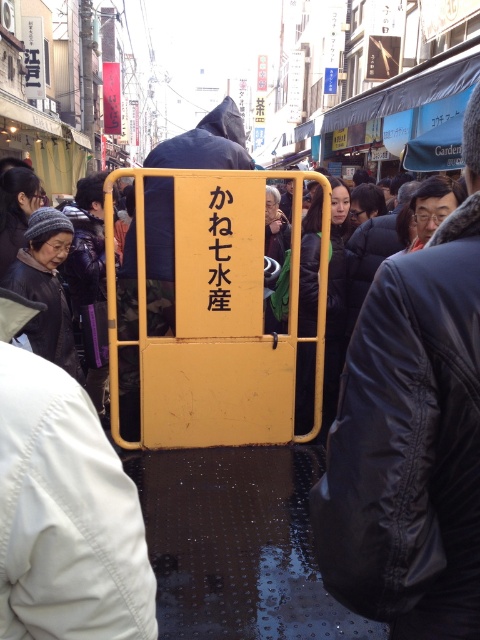
Question: Can you confirm if yellow matte gate at center is bigger than dark gray knit hat at left?

Choices:
 (A) yes
 (B) no

Answer: (B)

Question: Does yellow matte gate at center come in front of dark gray knit hat at left?

Choices:
 (A) yes
 (B) no

Answer: (A)

Question: Which point appears farthest from the camera in this image?

Choices:
 (A) (59, 220)
 (B) (399, 360)

Answer: (A)

Question: Is yellow matte gate at center to the right of dark gray knit hat at left from the viewer's perspective?

Choices:
 (A) no
 (B) yes

Answer: (B)